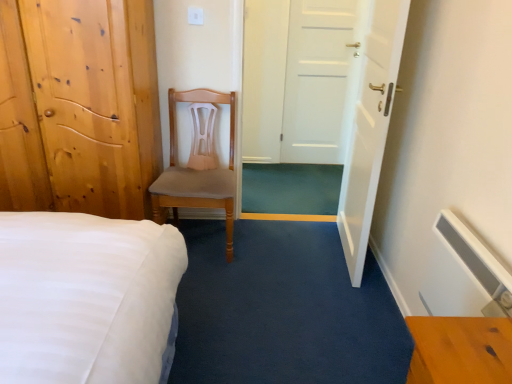
Question: From a real-world perspective, is white matte door at center, arranged as the 2th door when viewed from the left, located higher than light brown wooden door at left, the third door positioned from the right?

Choices:
 (A) yes
 (B) no

Answer: (A)

Question: From the image's perspective, is white matte door at center, arranged as the 2th door when viewed from the left, under light brown wooden door at left, the third door positioned from the right?

Choices:
 (A) no
 (B) yes

Answer: (A)

Question: Is white matte door at center, arranged as the 2th door when viewed from the left, located outside light brown wooden door at left, the third door positioned from the right?

Choices:
 (A) no
 (B) yes

Answer: (B)

Question: Is white matte door at center, which appears as the 2th door when viewed from the right, positioned behind light brown wooden door at left, the third door positioned from the right?

Choices:
 (A) yes
 (B) no

Answer: (A)

Question: Is white matte door at center, arranged as the 2th door when viewed from the left, positioned with its back to light brown wooden door at left, which is the first door from left to right?

Choices:
 (A) no
 (B) yes

Answer: (A)

Question: Is white matte door at center, arranged as the 2th door when viewed from the left, aimed at light brown wooden door at left, which is the first door from left to right?

Choices:
 (A) no
 (B) yes

Answer: (A)

Question: From a real-world perspective, does white glossy door at center, the 3th door viewed from the left, sit lower than light brown wooden door at left, which is the first door from left to right?

Choices:
 (A) no
 (B) yes

Answer: (A)

Question: From the image's perspective, is white glossy door at center, placed as the first door when sorted from right to left, below light brown wooden door at left, the third door positioned from the right?

Choices:
 (A) yes
 (B) no

Answer: (A)

Question: Is white glossy door at center, the 3th door viewed from the left, wider than light brown wooden door at left, which is the first door from left to right?

Choices:
 (A) no
 (B) yes

Answer: (A)

Question: Is white glossy door at center, the 3th door viewed from the left, facing towards light brown wooden door at left, which is the first door from left to right?

Choices:
 (A) yes
 (B) no

Answer: (A)

Question: Does white glossy door at center, placed as the first door when sorted from right to left, have a greater height compared to light brown wooden door at left, which is the first door from left to right?

Choices:
 (A) no
 (B) yes

Answer: (B)

Question: Is the depth of white glossy door at center, placed as the first door when sorted from right to left, greater than that of light brown wooden door at left, which is the first door from left to right?

Choices:
 (A) no
 (B) yes

Answer: (B)

Question: Considering the relative sizes of light brown wood chair at center and white glossy door at center, the 3th door viewed from the left, in the image provided, is light brown wood chair at center wider than white glossy door at center, the 3th door viewed from the left,?

Choices:
 (A) no
 (B) yes

Answer: (B)